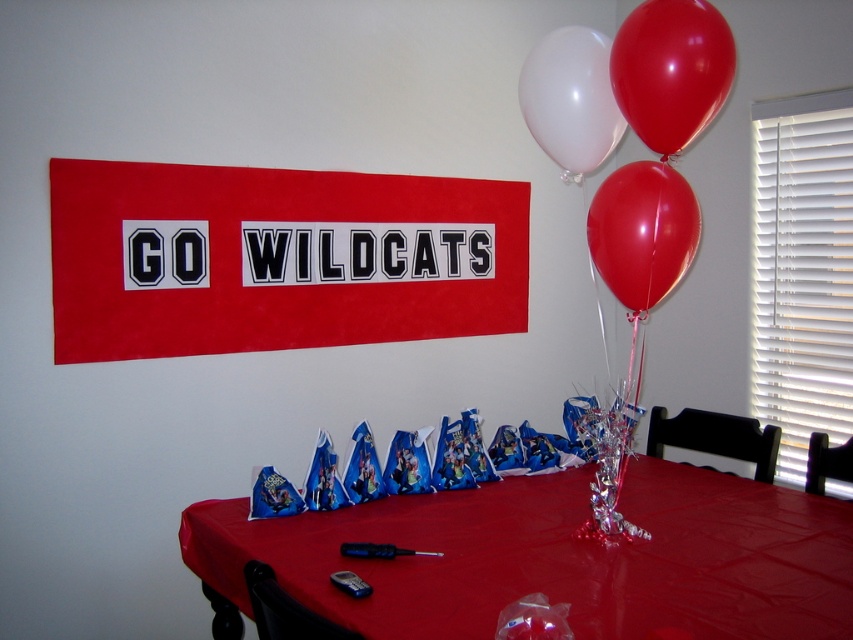
Question: Which object is farther from the camera taking this photo?

Choices:
 (A) red plastic table at center
 (B) red fabric banner at upper center

Answer: (B)

Question: Among these objects, which one is farthest from the camera?

Choices:
 (A) rubber balloon at upper right
 (B) rubber glossy balloon at upper right
 (C) red fabric banner at upper center

Answer: (C)

Question: Is red fabric banner at upper center below rubber balloon at upper right?

Choices:
 (A) yes
 (B) no

Answer: (A)

Question: Which point is farther to the camera?

Choices:
 (A) (584, 132)
 (B) (712, 61)
 (C) (322, 179)
 (D) (639, 202)

Answer: (C)

Question: Is rubber glossy balloon at upper right positioned in front of white glossy balloon at upper center?

Choices:
 (A) yes
 (B) no

Answer: (A)

Question: Can you confirm if rubber glossy balloon at upper right is thinner than white glossy balloon at upper center?

Choices:
 (A) no
 (B) yes

Answer: (B)